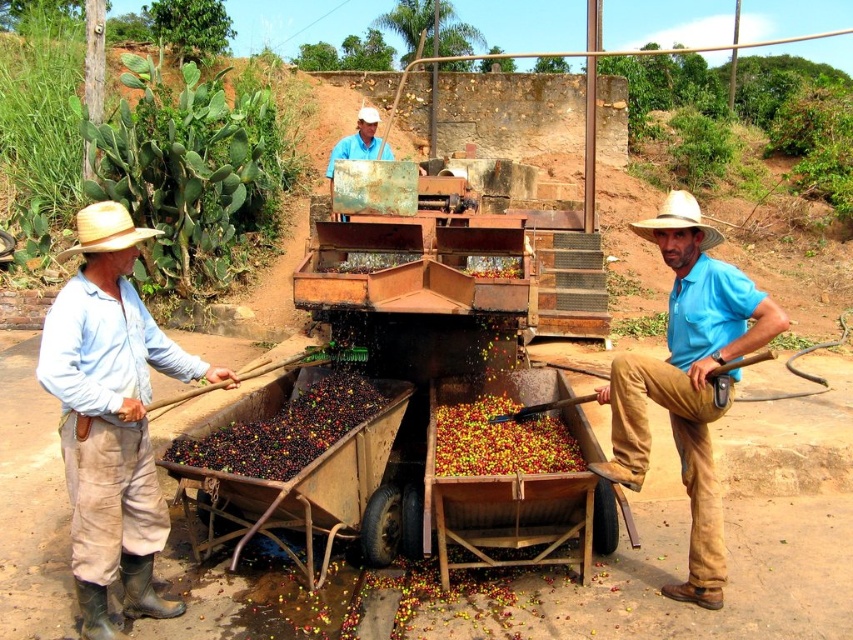
Question: Which of the following is the closest to the observer?

Choices:
 (A) straw hat at left
 (B) light blue shirt at center

Answer: (A)

Question: Among these objects, which one is farthest from the camera?

Choices:
 (A) shiny red coffee beans at center
 (B) straw hat at left

Answer: (A)

Question: Does wooden cart at center appear on the right side of straw hat at left?

Choices:
 (A) yes
 (B) no

Answer: (A)

Question: Does light blue cotton shirt at left have a greater width compared to brown matte coffee beans at center?

Choices:
 (A) no
 (B) yes

Answer: (B)

Question: Which object appears farthest from the camera in this image?

Choices:
 (A) light blue cotton shirt at left
 (B) straw hat at left

Answer: (B)

Question: Does light blue cotton shirt at left appear on the left side of shiny dark red coffee beans at center?

Choices:
 (A) no
 (B) yes

Answer: (B)